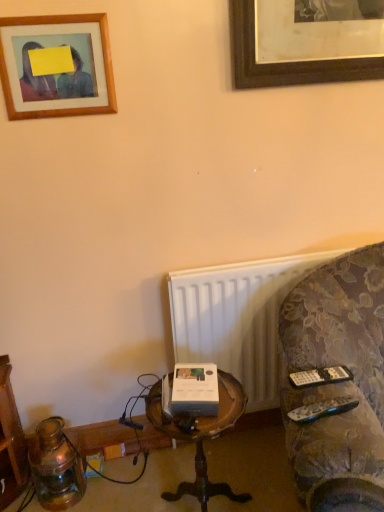
Identify the location of free spot above woodenobject at center (from a real-world perspective). The width and height of the screenshot is (384, 512). (205, 413).